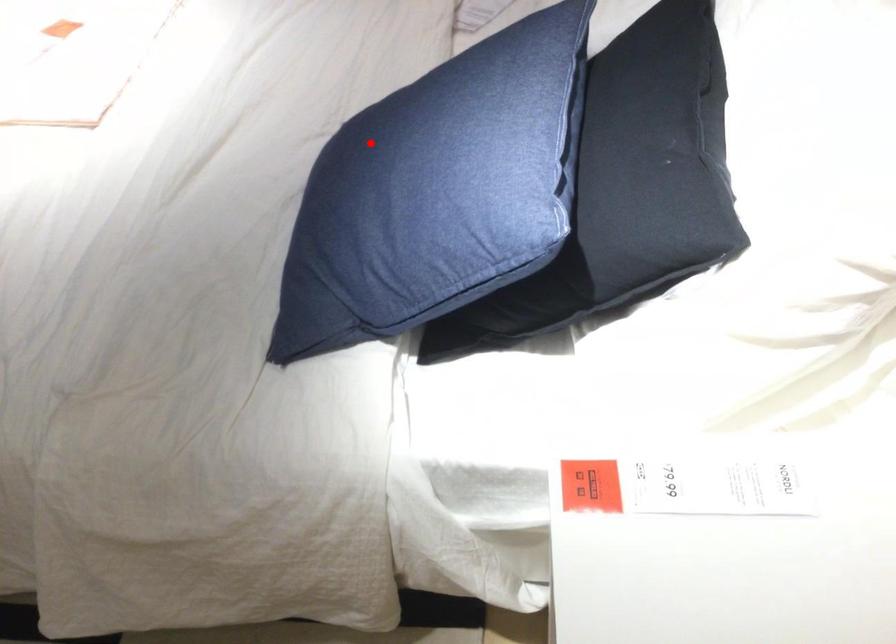
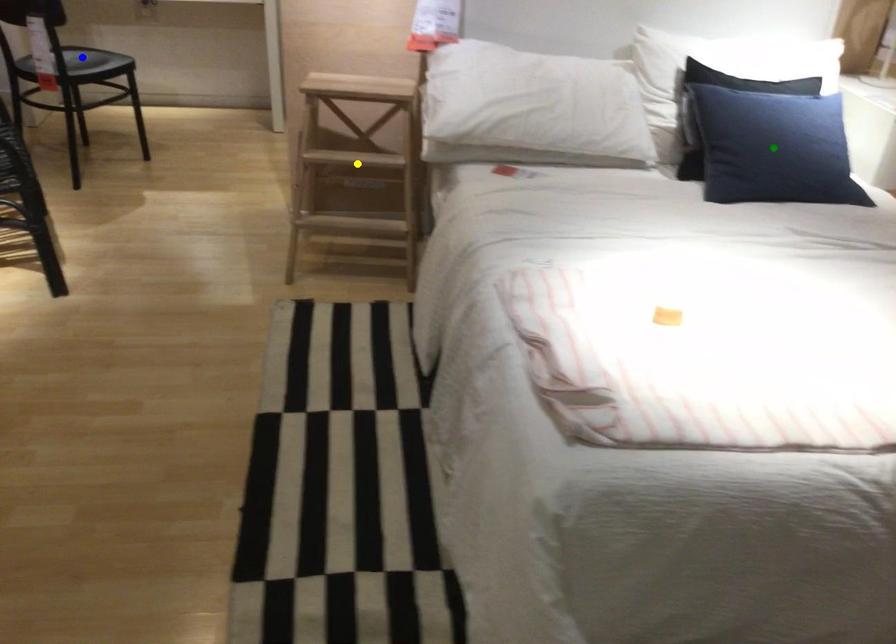
Question: I am providing you with two images of the same scene from different viewpoints. A red point is marked on the first image. You are given multiple points on the second image. In image 2, which mark is for the same physical point as the one in image 1?

Choices:
 (A) green point
 (B) yellow point
 (C) blue point

Answer: (A)